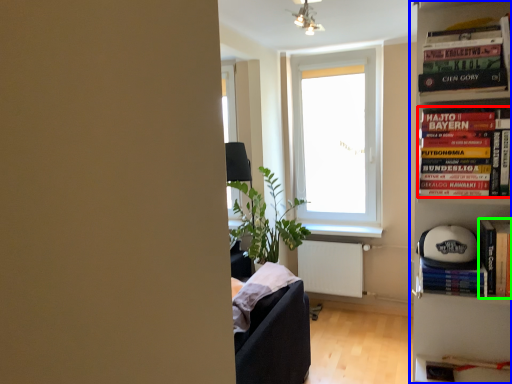
Question: Which object is the farthest from book (highlighted by a red box)? Choose among these: bookcase (highlighted by a blue box) or book (highlighted by a green box).

Choices:
 (A) bookcase
 (B) book

Answer: (A)